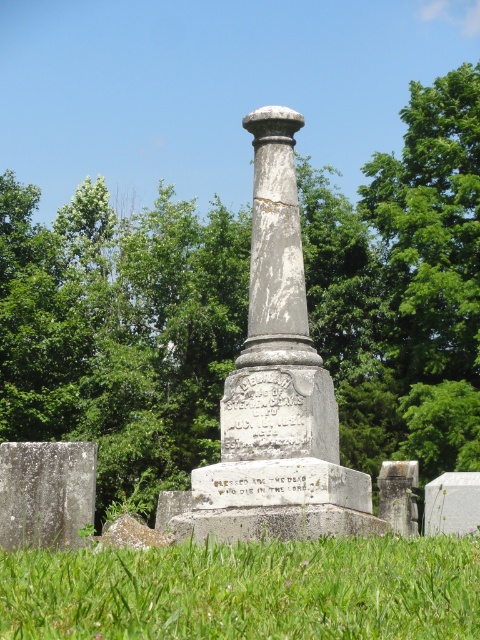
You are a groundskeeper who needs to water the green leafy tree at center and the white stone gravestone at lower left. Your watering can holds enough water for 50 meters of travel. Can you water both without refilling?

The distance between the green leafy tree at center and the white stone gravestone at lower left is 52.45 meters. Since your watering can only holds enough for 50 meters of travel, you cannot water both without refilling.

You are a visitor at the cemetery and want to take a photo of the white marble column at center and the gray stone column at center. Which column should you focus on first if you want to capture both in one frame without moving the camera?

You should focus on the gray stone column at center first because it is located above the white marble column at center, so adjusting the camera to include the upper one first will help capture both in the frame.

You are standing at the entrance of the cemetery and see the green leafy tree at center and the white stone gravestone at lower left. Which object is closer to the entrance?

The white stone gravestone at lower left is closer to the entrance because it is positioned to the left of the green leafy tree at center, which is further away on the right side.